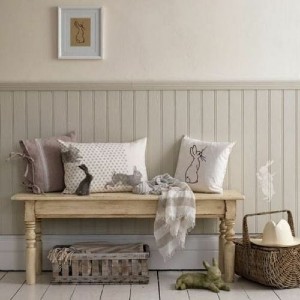
Where is `large white pillow with gray bunnies and polka dots`? This screenshot has height=300, width=300. large white pillow with gray bunnies and polka dots is located at coordinates (132, 156).